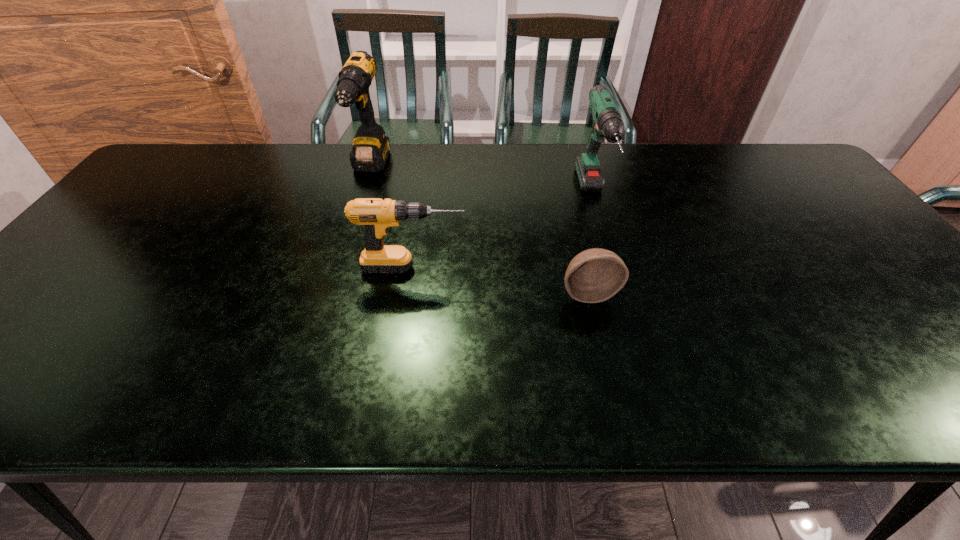
Identify the location of vacant space that satisfies the following two spatial constraints: 1. at the tip of the leftmost object; 2. on the right side of the bowl. (331, 293).

Identify the location of vacant area that satisfies the following two spatial constraints: 1. at the tip of the nearest object; 2. on the left side of the leftmost drill. (331, 293).

Identify the location of free location that satisfies the following two spatial constraints: 1. at the tip of the nearest object; 2. on the right side of the second shortest object. This screenshot has width=960, height=540. (409, 293).

Identify the location of free point that satisfies the following two spatial constraints: 1. at the tip of the second drill from right to left; 2. on the left side of the bowl. (409, 293).